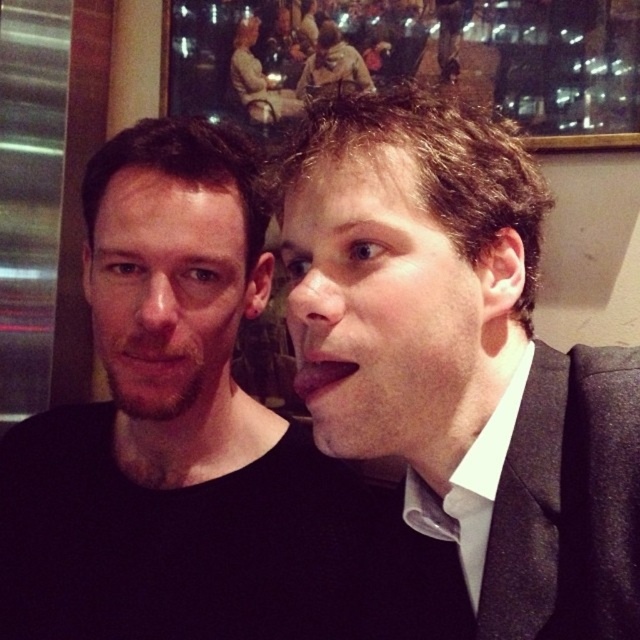
Question: Estimate the real-world distances between objects in this image. Which object is closer to the black matte shirt at left?

Choices:
 (A) dark brown hair at right
 (B) matte skin face at center
 (C) brown leather jacket at upper center

Answer: (A)

Question: Which point appears closest to the camera in this image?

Choices:
 (A) (378, 412)
 (B) (112, 564)
 (C) (376, 605)
 (D) (365, 83)

Answer: (A)

Question: Does dark brown hair at right lie in front of matte skin face at center?

Choices:
 (A) no
 (B) yes

Answer: (B)

Question: Is dark brown hair at right further to the viewer compared to bearded man at left?

Choices:
 (A) yes
 (B) no

Answer: (B)

Question: Does black matte shirt at left have a greater width compared to bearded man at left?

Choices:
 (A) yes
 (B) no

Answer: (A)

Question: Which object is farther from the camera taking this photo?

Choices:
 (A) bearded man at left
 (B) dark brown hair at right
 (C) dark gray wool business suit at right

Answer: (A)